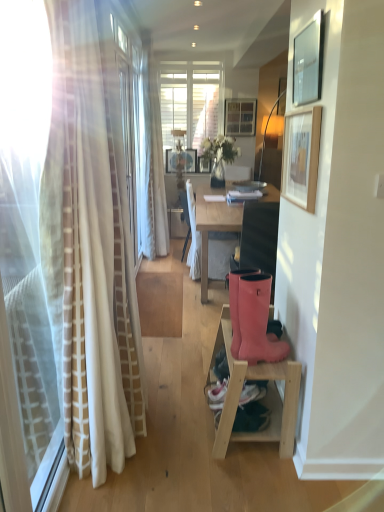
Locate an element on the screen. This screenshot has width=384, height=512. pink rubber boots at lower right is located at coordinates (260, 238).

What do you see at coordinates (301, 157) in the screenshot?
I see `wooden picture frame at upper right, the first picture frame positioned from the bottom` at bounding box center [301, 157].

The height and width of the screenshot is (512, 384). Find the location of `rubber boots at lower right`. rubber boots at lower right is located at coordinates (252, 318).

At what (x,y) coordinates should I click in order to perform the action: click on white fabric chair at center. Please return your answer as a coordinate pair (x, y). Looking at the image, I should click on (221, 253).

Locate an element on the screen. Image resolution: width=384 pixels, height=512 pixels. translucent glass vase at center is located at coordinates (220, 149).

Would you say wooden picture frame at upper center, marked as the 4th picture frame in a left-to-right arrangement, is part of wooden picture frame at upper right, marked as the 3th picture frame in a right-to-left arrangement,'s contents?

That's incorrect, wooden picture frame at upper center, marked as the 4th picture frame in a left-to-right arrangement, is not inside wooden picture frame at upper right, marked as the 3th picture frame in a right-to-left arrangement.

Who is more distant, wooden picture frame at upper right, marked as the 3th picture frame in a right-to-left arrangement, or wooden picture frame at upper center, acting as the 4th picture frame starting from the bottom?

wooden picture frame at upper center, acting as the 4th picture frame starting from the bottom, is more distant.

Is point (288, 145) in front of point (253, 102)?

Yes, point (288, 145) is closer to viewer.

From the image's perspective, between matte black picture frame at upper right, the second picture frame from the bottom, and wooden picture frame at upper right, which is counted as the third picture frame, starting from the back, which one is located above?

matte black picture frame at upper right, the second picture frame from the bottom.

Is the surface of matte black picture frame at upper right, the second picture frame from the bottom, in direct contact with wooden picture frame at upper right, placed as the 2th picture frame when sorted from front to back?

They are not placed beside each other.

Considering the relative sizes of matte black picture frame at upper right, the fourth picture frame positioned from the back, and wooden picture frame at upper right, marked as the 3th picture frame in a right-to-left arrangement, in the image provided, is matte black picture frame at upper right, the fourth picture frame positioned from the back, thinner than wooden picture frame at upper right, marked as the 3th picture frame in a right-to-left arrangement,?

Yes.

Considering the points (296, 59) and (313, 153), which point is in front, point (296, 59) or point (313, 153)?

The point (313, 153) is in front.

Which is closer to the camera, (208, 267) or (322, 42)?

Clearly, point (208, 267) is more distant from the camera than point (322, 42).

Which of these two, white fabric chair at center or matte black picture frame at upper right, the fourth picture frame positioned from the back, is thinner?

Thinner between the two is matte black picture frame at upper right, the fourth picture frame positioned from the back.

From the image's perspective, which is above, white fabric chair at center or matte black picture frame at upper right, which is the second picture frame in right-to-left order?

matte black picture frame at upper right, which is the second picture frame in right-to-left order, is shown above in the image.

Locate an element on the screen. picture frame that is the 2nd object located in front of the white fabric chair at center is located at coordinates (308, 62).

Can you confirm if white fabric chair at center is taller than light wood shelf at lower right?

Correct, white fabric chair at center is much taller as light wood shelf at lower right.

Are white fabric chair at center and light wood shelf at lower right far apart?

Absolutely, white fabric chair at center is distant from light wood shelf at lower right.

In the scene shown: Is white fabric chair at center turned away from light wood shelf at lower right?

No, white fabric chair at center's orientation is not away from light wood shelf at lower right.

Which is closer, (220,247) or (294,362)?

Point (220,247) appears to be farther away from the viewer than point (294,362).

Based on the photo, from the image's perspective, which one is positioned lower, matte black picture frame at upper right, which appears as the 1th picture frame when viewed from the front, or wooden picture frame at upper center, marked as the 4th picture frame in a left-to-right arrangement?

matte black picture frame at upper right, which appears as the 1th picture frame when viewed from the front, is shown below in the image.

How many degrees apart are the facing directions of matte black picture frame at upper right, the fourth picture frame positioned from the back, and wooden picture frame at upper center, which is the 3th picture frame from front to back?

89.9 degrees separate the facing orientations of matte black picture frame at upper right, the fourth picture frame positioned from the back, and wooden picture frame at upper center, which is the 3th picture frame from front to back.

Is matte black picture frame at upper right, which appears as the 1th picture frame when viewed from the front, inside the boundaries of wooden picture frame at upper center, arranged as the 1th picture frame when viewed from the right, or outside?

matte black picture frame at upper right, which appears as the 1th picture frame when viewed from the front, exists outside the volume of wooden picture frame at upper center, arranged as the 1th picture frame when viewed from the right.

Which object is thinner, matte black picture frame at upper right, which appears as the 1th picture frame when viewed from the front, or wooden picture frame at upper center, the first picture frame viewed from the top?

Thinner between the two is matte black picture frame at upper right, which appears as the 1th picture frame when viewed from the front.

Considering the relative sizes of matte black picture frame at upper right, acting as the 3th picture frame starting from the left, and translucent glass vase at center in the image provided, is matte black picture frame at upper right, acting as the 3th picture frame starting from the left, thinner than translucent glass vase at center?

Yes, matte black picture frame at upper right, acting as the 3th picture frame starting from the left, is thinner than translucent glass vase at center.

Between matte black picture frame at upper right, acting as the 3th picture frame starting from the left, and translucent glass vase at center, which one has more height?

translucent glass vase at center is taller.

From the picture: What's the angular difference between matte black picture frame at upper right, which appears as the 1th picture frame when viewed from the front, and translucent glass vase at center's facing directions?

1.45 degrees.

Is point (293, 85) more distant than point (227, 156)?

No, (293, 85) is in front of (227, 156).

How different are the orientations of matte black picture frame at upper right, which is the second picture frame in right-to-left order, and white fabric chair at center in degrees?

The facing directions of matte black picture frame at upper right, which is the second picture frame in right-to-left order, and white fabric chair at center are 179 degrees apart.

From the image's perspective, would you say matte black picture frame at upper right, which is the second picture frame in right-to-left order, is shown under white fabric chair at center?

No, from the image's perspective, matte black picture frame at upper right, which is the second picture frame in right-to-left order, is not below white fabric chair at center.

Is matte black picture frame at upper right, acting as the 3th picture frame starting from the left, spatially inside white fabric chair at center, or outside of it?

matte black picture frame at upper right, acting as the 3th picture frame starting from the left, lies outside white fabric chair at center.

Is matte black picture frame at upper right, which is the second picture frame in right-to-left order, to the left or to the right of white fabric chair at center in the image?

Based on their positions, matte black picture frame at upper right, which is the second picture frame in right-to-left order, is located to the right of white fabric chair at center.

There is a wooden picture frame at upper center, which is the 3th picture frame from front to back. Where is `the 1st picture frame below it (from a real-world perspective)`? Image resolution: width=384 pixels, height=512 pixels. the 1st picture frame below it (from a real-world perspective) is located at coordinates (301, 157).

Where is `the 1st picture frame behind the matte black picture frame at upper right, the fourth picture frame positioned from the back`? This screenshot has width=384, height=512. the 1st picture frame behind the matte black picture frame at upper right, the fourth picture frame positioned from the back is located at coordinates (301, 157).

Considering their positions, is white fabric chair at center positioned closer to matte black picture frame at upper right, placed as the 3th picture frame when sorted from top to bottom, than rubber boots at lower right?

rubber boots at lower right is closer to matte black picture frame at upper right, placed as the 3th picture frame when sorted from top to bottom.

Which object lies further to the anchor point pink rubber boots at lower right, wooden picture frame at upper center, acting as the 4th picture frame starting from the bottom, or rubber boots at lower right?

wooden picture frame at upper center, acting as the 4th picture frame starting from the bottom, is further to pink rubber boots at lower right.

From the image, which object appears to be farther from matte black picture frame at upper right, placed as the 3th picture frame when sorted from top to bottom, rubber boots at lower right or wooden picture frame at center, which is counted as the second picture frame, starting from the top?

The object further to matte black picture frame at upper right, placed as the 3th picture frame when sorted from top to bottom, is wooden picture frame at center, which is counted as the second picture frame, starting from the top.

When comparing their distances from translucent glass vase at center, does pink rubber boots at lower right or rubber boots at lower right seem further?

Among the two, rubber boots at lower right is located further to translucent glass vase at center.

From the image, which object appears to be farther from pink rubber boots at lower right, wooden picture frame at upper center, the first picture frame viewed from the top, or wooden picture frame at upper right, placed as the 4th picture frame when sorted from top to bottom?

Among the two, wooden picture frame at upper center, the first picture frame viewed from the top, is located further to pink rubber boots at lower right.

When comparing their distances from rubber boots at lower right, does translucent glass vase at center or light wood shelf at lower right seem further?

The object further to rubber boots at lower right is translucent glass vase at center.

Which object lies further to the anchor point white fabric chair at center, matte black picture frame at upper right, placed as the 3th picture frame when sorted from top to bottom, or wooden picture frame at upper right, placed as the 4th picture frame when sorted from top to bottom?

The object further to white fabric chair at center is matte black picture frame at upper right, placed as the 3th picture frame when sorted from top to bottom.

When comparing their distances from light wood shelf at lower right, does translucent glass vase at center or matte black picture frame at upper right, acting as the 3th picture frame starting from the left, seem closer?

Based on the image, matte black picture frame at upper right, acting as the 3th picture frame starting from the left, appears to be nearer to light wood shelf at lower right.

Where is `swivel chair between wooden picture frame at upper right, which is the second picture frame in left-to-right order, and translucent glass vase at center in the front-back direction`? swivel chair between wooden picture frame at upper right, which is the second picture frame in left-to-right order, and translucent glass vase at center in the front-back direction is located at coordinates click(x=260, y=238).

Identify the location of flower located between light wood shelf at lower right and wooden picture frame at upper center, which is the 3th picture frame from front to back, in the depth direction. The width and height of the screenshot is (384, 512). (220, 149).

I want to click on swivel chair between rubber boots at lower right and translucent glass vase at center from front to back, so click(260, 238).

Where is `flower between rubber boots at lower right and wooden picture frame at center, the third picture frame from the bottom, along the z-axis`? This screenshot has height=512, width=384. flower between rubber boots at lower right and wooden picture frame at center, the third picture frame from the bottom, along the z-axis is located at coordinates (220, 149).